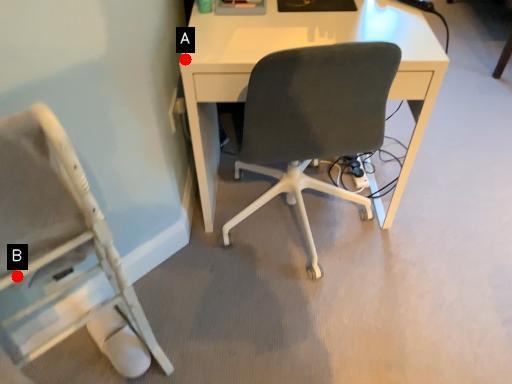
Question: Two points are circled on the image, labeled by A and B beside each circle. Which point is farther from the camera taking this photo?

Choices:
 (A) A is further
 (B) B is further

Answer: (A)